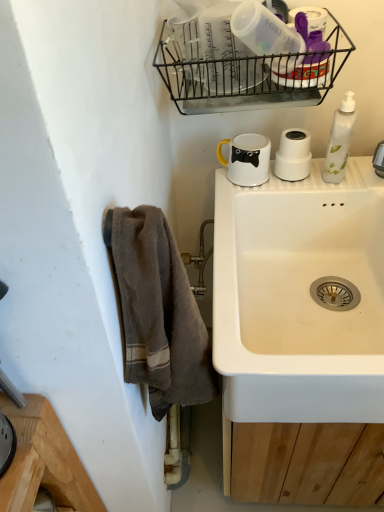
What are the coordinates of `vacant region in front of white glossy mug at upper right` in the screenshot? It's located at (246, 195).